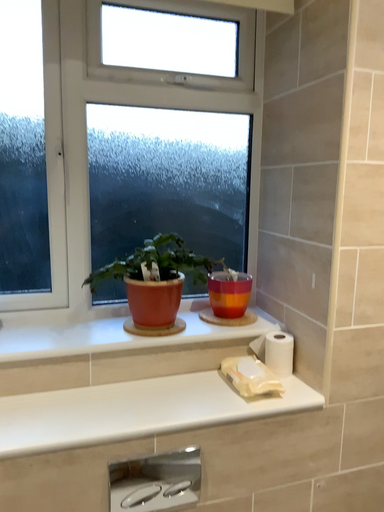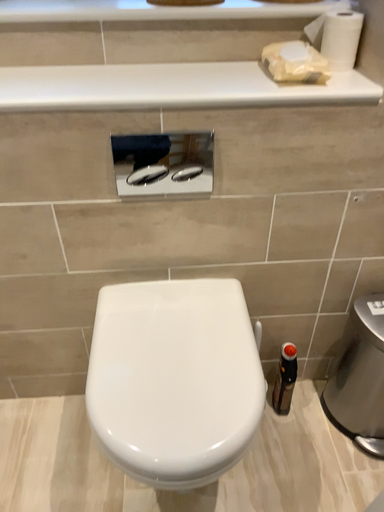
Question: How did the camera likely rotate when shooting the video?

Choices:
 (A) rotated upward
 (B) rotated downward

Answer: (B)